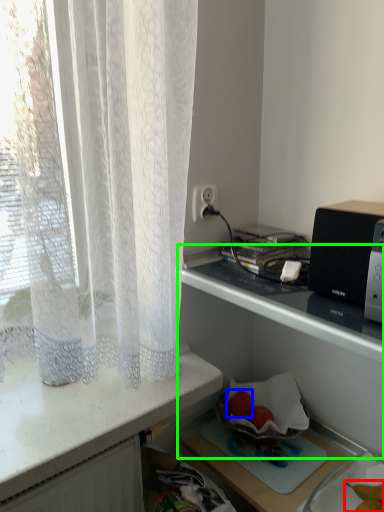
Question: Estimate the real-world distances between objects in this image. Which object is farther from food (highlighted by a red box), fruit (highlighted by a blue box) or shelf (highlighted by a green box)?

Choices:
 (A) fruit
 (B) shelf

Answer: (B)